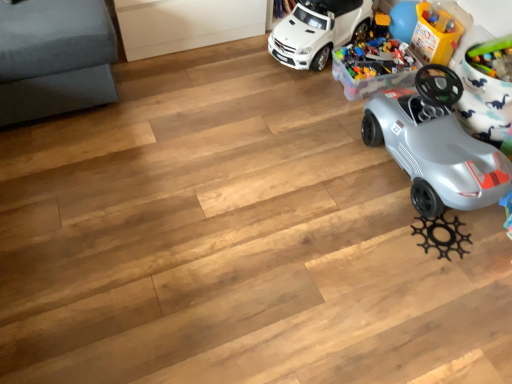
Question: Does translucent plastic toy at upper right, positioned as the 1th toy in right-to-left order, have a lesser height compared to silver metallic car at right, which appears as the 2th car when viewed from the top?

Choices:
 (A) no
 (B) yes

Answer: (B)

Question: Is the depth of translucent plastic toy at upper right, the 2th toy in the left-to-right sequence, less than that of silver metallic car at right, positioned as the 1th car in bottom-to-top order?

Choices:
 (A) no
 (B) yes

Answer: (A)

Question: Is translucent plastic toy at upper right, positioned as the 1th toy in right-to-left order, looking in the opposite direction of silver metallic car at right, positioned as the 1th car in bottom-to-top order?

Choices:
 (A) no
 (B) yes

Answer: (A)

Question: Does translucent plastic toy at upper right, positioned as the 1th toy in right-to-left order, have a lesser width compared to silver metallic car at right, which appears as the 2th car when viewed from the top?

Choices:
 (A) yes
 (B) no

Answer: (A)

Question: From the image's perspective, is translucent plastic toy at upper right, the 2th toy in the left-to-right sequence, over silver metallic car at right, which appears as the 2th car when viewed from the top?

Choices:
 (A) no
 (B) yes

Answer: (B)

Question: Is white matte toy car at upper center, the 1th car in the top-to-bottom sequence, bigger or smaller than silver metallic car at right, which appears as the 2th car when viewed from the top?

Choices:
 (A) big
 (B) small

Answer: (B)

Question: Considering their positions, is white matte toy car at upper center, the 1th car in the top-to-bottom sequence, located in front of or behind silver metallic car at right, which appears as the 2th car when viewed from the top?

Choices:
 (A) front
 (B) behind

Answer: (B)

Question: Is white matte toy car at upper center, which is the 2th car in bottom-to-top order, taller or shorter than silver metallic car at right, positioned as the 1th car in bottom-to-top order?

Choices:
 (A) tall
 (B) short

Answer: (B)

Question: Considering the positions of white matte toy car at upper center, the 1th car in the top-to-bottom sequence, and silver metallic car at right, positioned as the 1th car in bottom-to-top order, in the image, is white matte toy car at upper center, the 1th car in the top-to-bottom sequence, wider or thinner than silver metallic car at right, positioned as the 1th car in bottom-to-top order,?

Choices:
 (A) wide
 (B) thin

Answer: (A)

Question: Looking at the image, does white matte toy car at upper center, the 1th car in the top-to-bottom sequence, seem bigger or smaller compared to translucent plastic toy at upper right, positioned as the 1th toy in right-to-left order?

Choices:
 (A) big
 (B) small

Answer: (A)

Question: Would you say white matte toy car at upper center, the 1th car in the top-to-bottom sequence, is to the left or to the right of translucent plastic toy at upper right, the 2th toy in the left-to-right sequence, in the picture?

Choices:
 (A) left
 (B) right

Answer: (A)

Question: Considering the positions of white matte toy car at upper center, the 1th car in the top-to-bottom sequence, and translucent plastic toy at upper right, positioned as the 1th toy in right-to-left order, in the image, is white matte toy car at upper center, the 1th car in the top-to-bottom sequence, taller or shorter than translucent plastic toy at upper right, positioned as the 1th toy in right-to-left order,?

Choices:
 (A) short
 (B) tall

Answer: (B)

Question: Considering their positions, is white matte toy car at upper center, which is the 2th car in bottom-to-top order, located in front of or behind translucent plastic toy at upper right, the 2th toy in the left-to-right sequence?

Choices:
 (A) front
 (B) behind

Answer: (A)

Question: Relative to translucent plastic container at upper right, the 1th toy in the left-to-right sequence, is translucent plastic toy at upper right, the 2th toy in the left-to-right sequence, in front or behind?

Choices:
 (A) front
 (B) behind

Answer: (B)

Question: In the image, is translucent plastic toy at upper right, the 2th toy in the left-to-right sequence, on the left side or the right side of translucent plastic container at upper right, marked as the second toy in a right-to-left arrangement?

Choices:
 (A) right
 (B) left

Answer: (A)